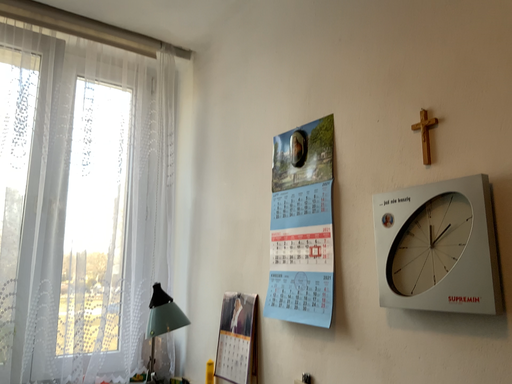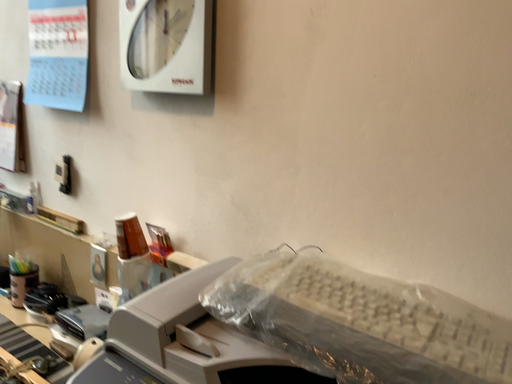
Question: Which way did the camera rotate in the video?

Choices:
 (A) rotated left
 (B) rotated right

Answer: (B)